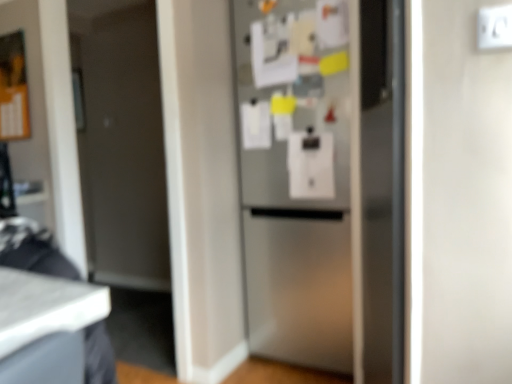
Question: Considering the relative sizes of satin silver refrigerator at center and white plastic electric outlet at upper right in the image provided, is satin silver refrigerator at center shorter than white plastic electric outlet at upper right?

Choices:
 (A) no
 (B) yes

Answer: (A)

Question: Is satin silver refrigerator at center placed right next to white plastic electric outlet at upper right?

Choices:
 (A) no
 (B) yes

Answer: (A)

Question: Is there a large distance between satin silver refrigerator at center and white plastic electric outlet at upper right?

Choices:
 (A) yes
 (B) no

Answer: (A)

Question: Does satin silver refrigerator at center have a greater height compared to white plastic electric outlet at upper right?

Choices:
 (A) yes
 (B) no

Answer: (A)

Question: From a real-world perspective, is satin silver refrigerator at center under white plastic electric outlet at upper right?

Choices:
 (A) no
 (B) yes

Answer: (B)

Question: Considering the relative sizes of satin silver refrigerator at center and white plastic electric outlet at upper right in the image provided, is satin silver refrigerator at center bigger than white plastic electric outlet at upper right?

Choices:
 (A) no
 (B) yes

Answer: (B)

Question: Is satin silver refrigerator at center at the back of white plastic electric outlet at upper right?

Choices:
 (A) no
 (B) yes

Answer: (A)

Question: Can you confirm if white plastic electric outlet at upper right is taller than satin silver refrigerator at center?

Choices:
 (A) no
 (B) yes

Answer: (A)

Question: Is white plastic electric outlet at upper right next to satin silver refrigerator at center and touching it?

Choices:
 (A) no
 (B) yes

Answer: (A)

Question: Is white plastic electric outlet at upper right smaller than satin silver refrigerator at center?

Choices:
 (A) yes
 (B) no

Answer: (A)

Question: Is the position of white plastic electric outlet at upper right more distant than that of satin silver refrigerator at center?

Choices:
 (A) no
 (B) yes

Answer: (A)

Question: Is satin silver refrigerator at center surrounded by white plastic electric outlet at upper right?

Choices:
 (A) no
 (B) yes

Answer: (A)

Question: In terms of size, does white plastic electric outlet at upper right appear bigger or smaller than satin silver refrigerator at center?

Choices:
 (A) small
 (B) big

Answer: (A)